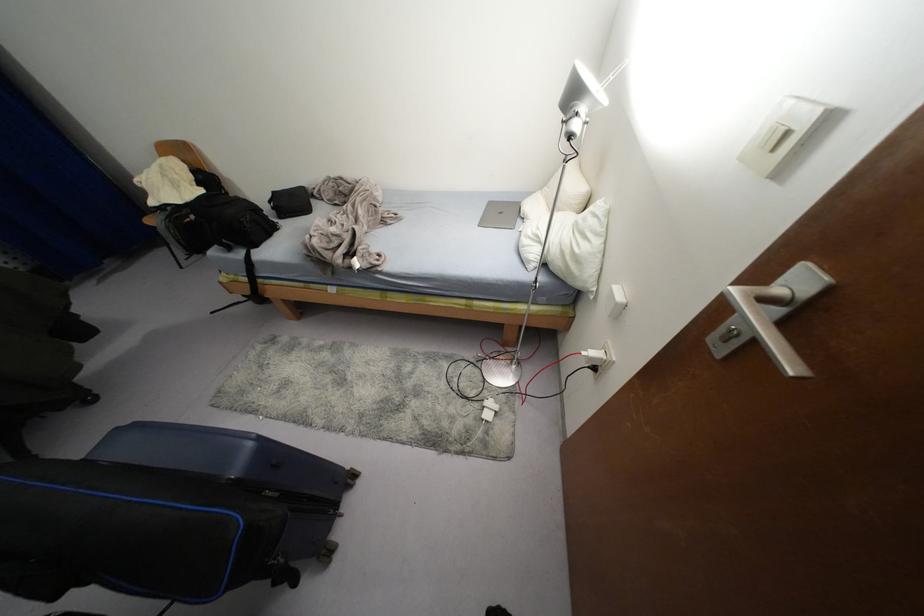
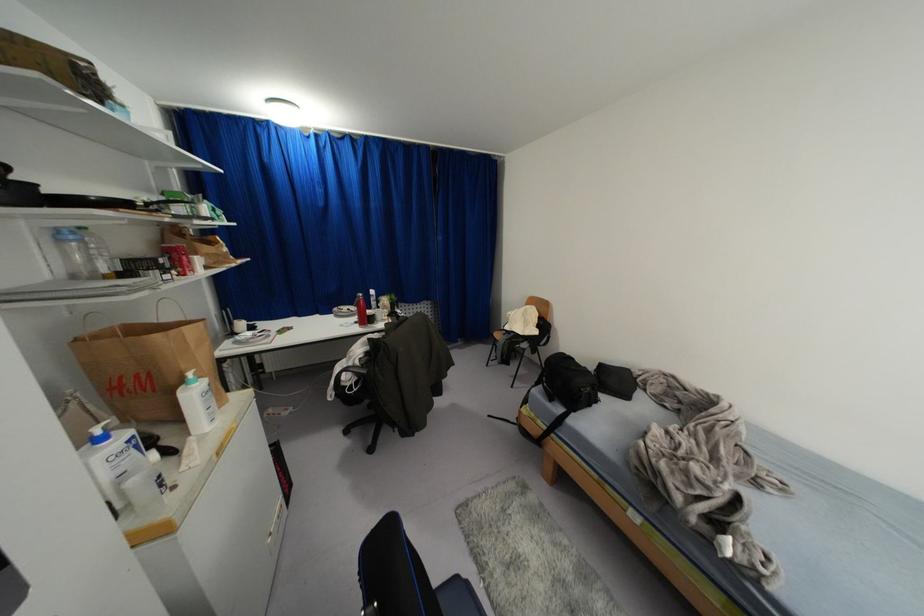
Question: The first image is from the beginning of the video and the second image is from the end. How did the camera likely rotate when shooting the video?

Choices:
 (A) Left
 (B) Right
 (C) Up
 (D) Down

Answer: (A)